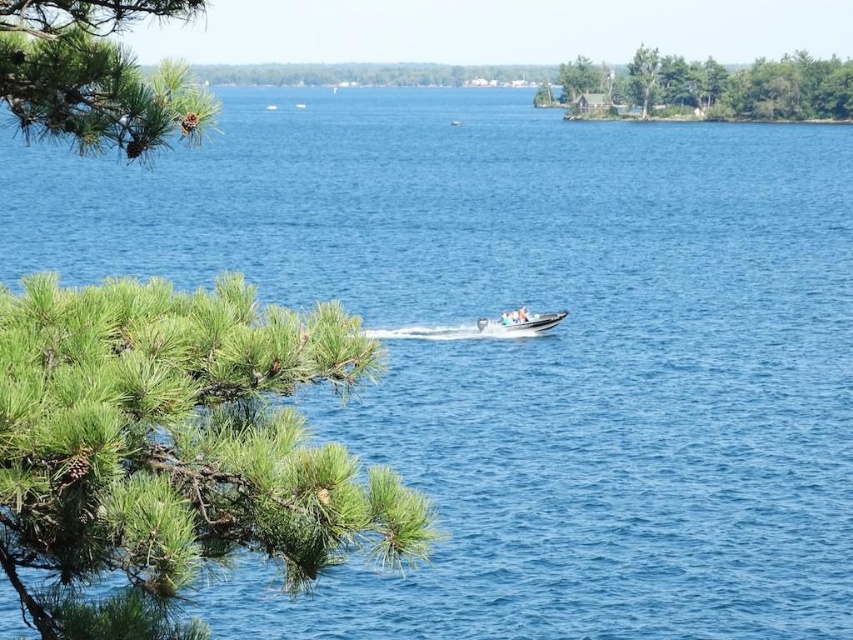
You are standing at the lakeside and want to reach both points marked in the image. Which point, point (16, 35) or point (685, 100), is closer to you?

Point (16, 35) is closer to you than point (685, 100).